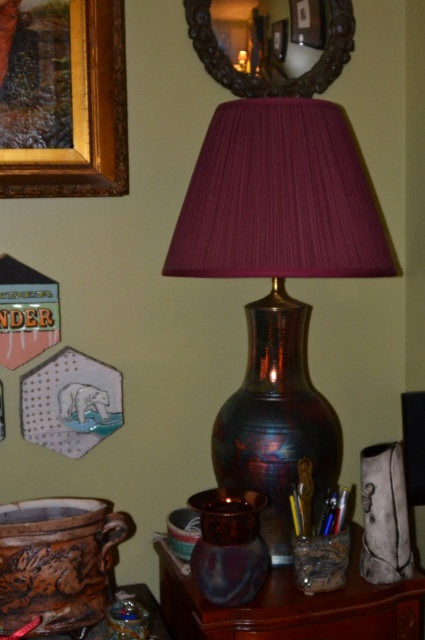
Which is behind, point (252, 600) or point (87, 124)?

Positioned behind is point (87, 124).

Does translucent glass vase at lower center appear under goldwooden frame at upper left?

Indeed, translucent glass vase at lower center is positioned under goldwooden frame at upper left.

The width and height of the screenshot is (425, 640). In order to click on translucent glass vase at lower center in this screenshot , I will do `click(292, 605)`.

Can you confirm if shiny purple vase at center is positioned to the right of brown wood drawer at lower center?

In fact, shiny purple vase at center is to the left of brown wood drawer at lower center.

Does point (206, 529) lie behind point (320, 596)?

No, it is in front of (320, 596).

Does point (240, 595) come behind point (399, 636)?

No, it is in front of (399, 636).

At what (x,y) coordinates should I click in order to perform the action: click on shiny purple vase at center. Please return your answer as a coordinate pair (x, y). The height and width of the screenshot is (640, 425). Looking at the image, I should click on (229, 545).

From the picture: Can you confirm if metallic maroon lampshade at center is thinner than goldwooden frame at upper left?

No.

Is metallic maroon lampshade at center further to camera compared to goldwooden frame at upper left?

No.

Is point (388, 266) positioned behind point (110, 170)?

No.

Identify the location of metallic maroon lampshade at center. The image size is (425, 640). (277, 276).